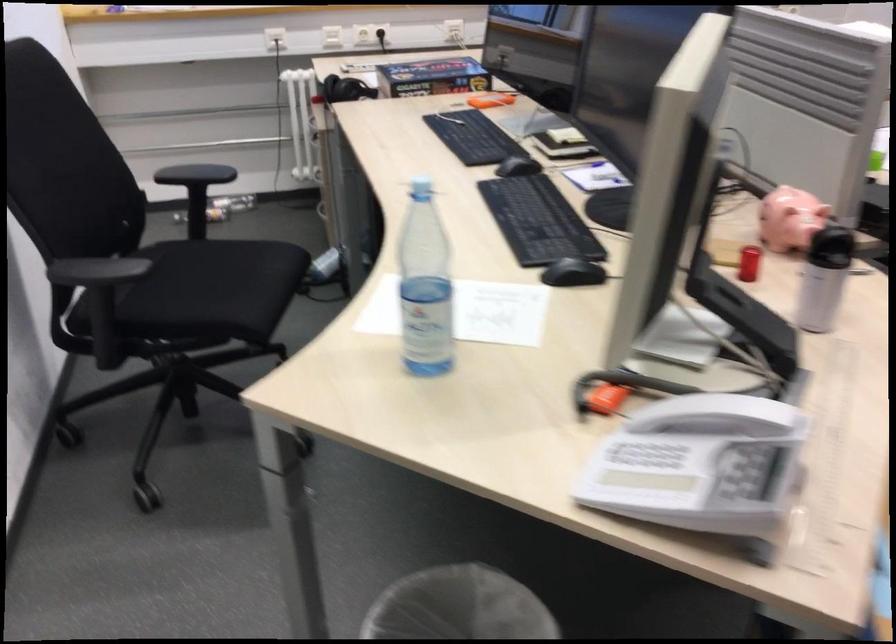
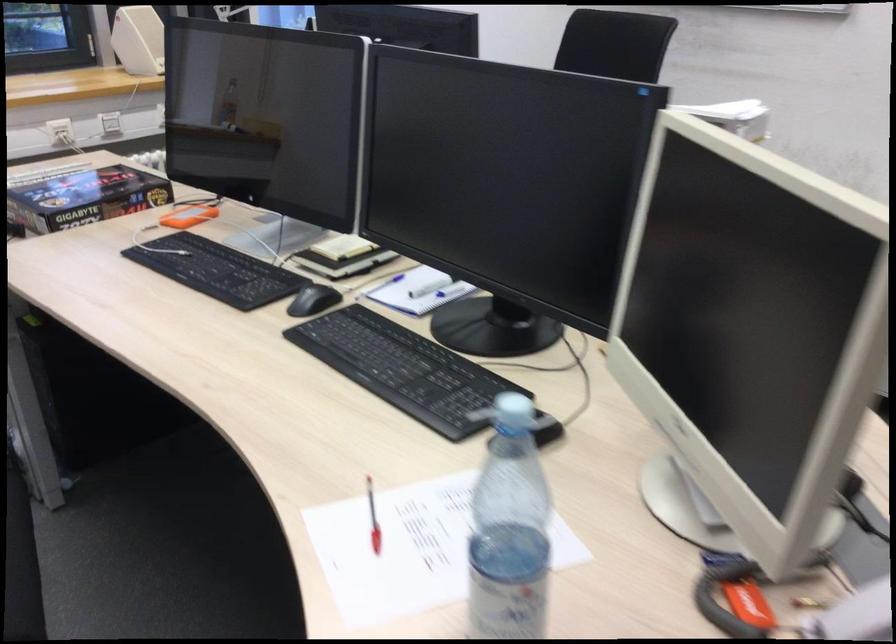
Question: The camera is either moving clockwise (left) or counter-clockwise (right) around the object. The first image is from the beginning of the video and the second image is from the end. Is the camera moving left or right when shooting the video?

Choices:
 (A) Left
 (B) Right

Answer: (A)